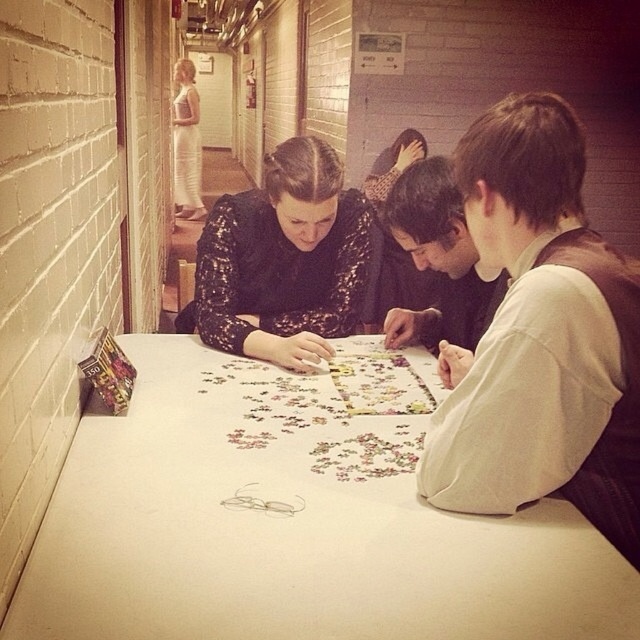
Question: Does white cotton shirt at upper right appear on the right side of patterned fabric shirt at center?

Choices:
 (A) yes
 (B) no

Answer: (B)

Question: Can you confirm if black sequined dress at center is bigger than dark brown hair at center?

Choices:
 (A) yes
 (B) no

Answer: (A)

Question: Does white cotton shirt at upper right come behind patterned fabric shirt at center?

Choices:
 (A) no
 (B) yes

Answer: (A)

Question: Based on their relative distances, which object is farther from the black sequined dress at center?

Choices:
 (A) patterned fabric shirt at center
 (B) white lace dress at upper left
 (C) dark brown hair at center

Answer: (B)

Question: Which object is farther from the camera taking this photo?

Choices:
 (A) white cotton shirt at upper right
 (B) patterned fabric shirt at center
 (C) dark brown hair at center
 (D) white matte table at center

Answer: (B)

Question: Which object is farther from the camera taking this photo?

Choices:
 (A) patterned fabric shirt at center
 (B) dark brown hair at center
 (C) black sequined dress at center
 (D) white matte table at center

Answer: (A)